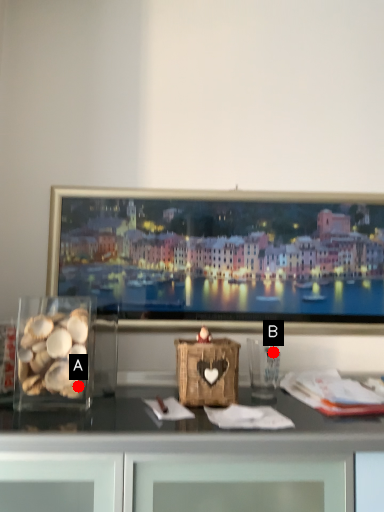
Question: Two points are circled on the image, labeled by A and B beside each circle. Which of the following is the closest to the observer?

Choices:
 (A) A is closer
 (B) B is closer

Answer: (A)